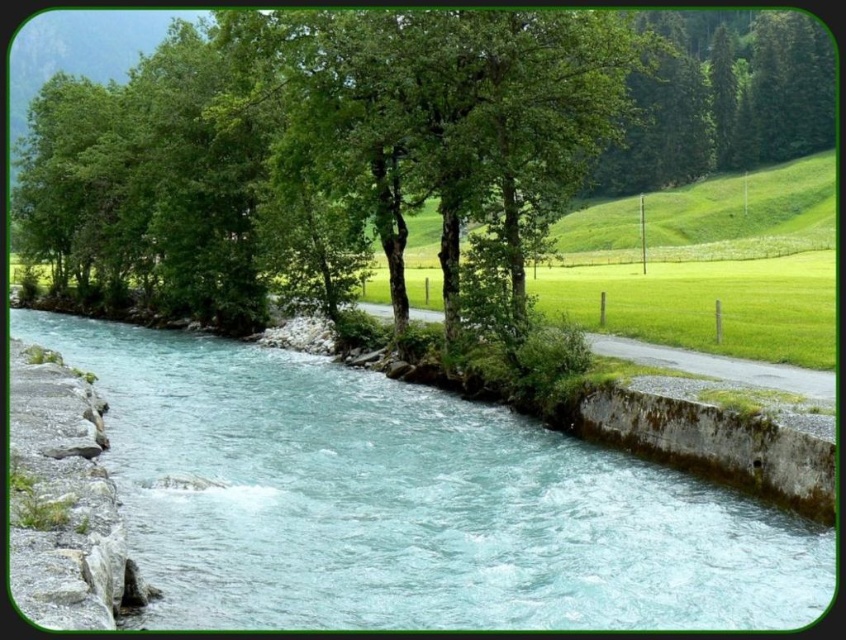
Question: Can you confirm if clear water at center is smaller than green leafy tree at upper center?

Choices:
 (A) yes
 (B) no

Answer: (A)

Question: Which point is closer to the camera?

Choices:
 (A) (647, 140)
 (B) (443, 544)

Answer: (B)

Question: Considering the relative positions of clear water at center and green leafy tree at upper center in the image provided, where is clear water at center located with respect to green leafy tree at upper center?

Choices:
 (A) above
 (B) below

Answer: (B)

Question: Where is clear water at center located in relation to green leafy tree at upper center in the image?

Choices:
 (A) below
 (B) above

Answer: (A)